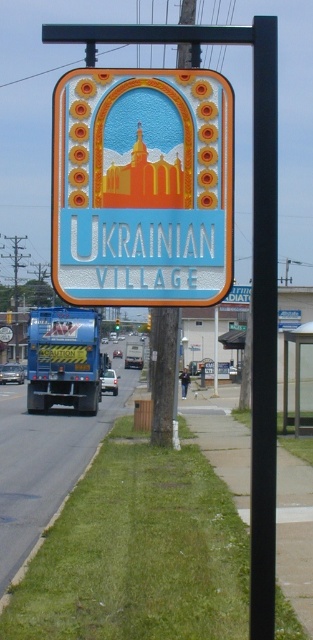
Based on the photo, you are a delivery driver who needs to park your neon yellow truck at lower left near the black metal pole at center. Considering the height difference between them, will the truck block the view of the signboard mounted on the pole when parked?

The black metal pole at center is taller than the neon yellow truck at lower left. Since the pole is taller, parking the truck near it won will not block the view of the signboard mounted on the pole because the signboard is higher up and visible above the truck.